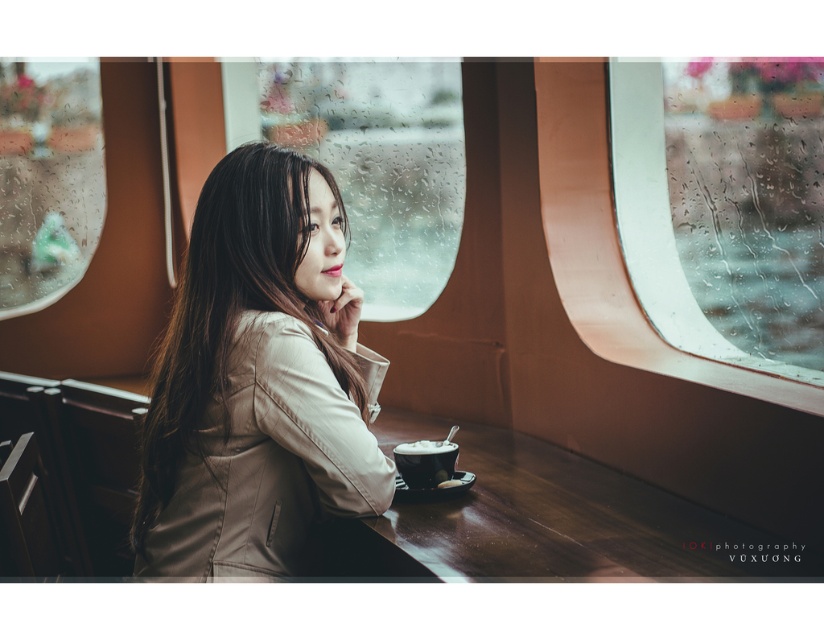
Does point (754, 65) lie behind point (222, 67)?

No, (754, 65) is closer to viewer.

From the picture: Between transparent glass train window at upper center and transparent glass train window at center, which one appears on the right side from the viewer's perspective?

transparent glass train window at upper center

Who is more distant from viewer, (775, 256) or (424, 225)?

Point (424, 225)

I want to click on transparent glass train window at upper center, so click(x=724, y=205).

Does transparent glass train window at upper left appear under white frothy coffee at lower center?

No, transparent glass train window at upper left is not below white frothy coffee at lower center.

Where is `transparent glass train window at upper left`? This screenshot has height=640, width=824. transparent glass train window at upper left is located at coordinates (47, 179).

Which is behind, point (1, 186) or point (431, 445)?

Positioned behind is point (1, 186).

Where is `transparent glass train window at upper left`? transparent glass train window at upper left is located at coordinates (47, 179).

Describe the element at coordinates (368, 161) in the screenshot. The height and width of the screenshot is (640, 824). I see `transparent glass train window at center` at that location.

Does transparent glass train window at center come in front of transparent glass train window at upper left?

Yes, transparent glass train window at center is in front of transparent glass train window at upper left.

Between point (261, 81) and point (41, 122), which one is positioned in front?

Point (261, 81) is in front.

Where is `transparent glass train window at center`? Image resolution: width=824 pixels, height=640 pixels. transparent glass train window at center is located at coordinates (368, 161).